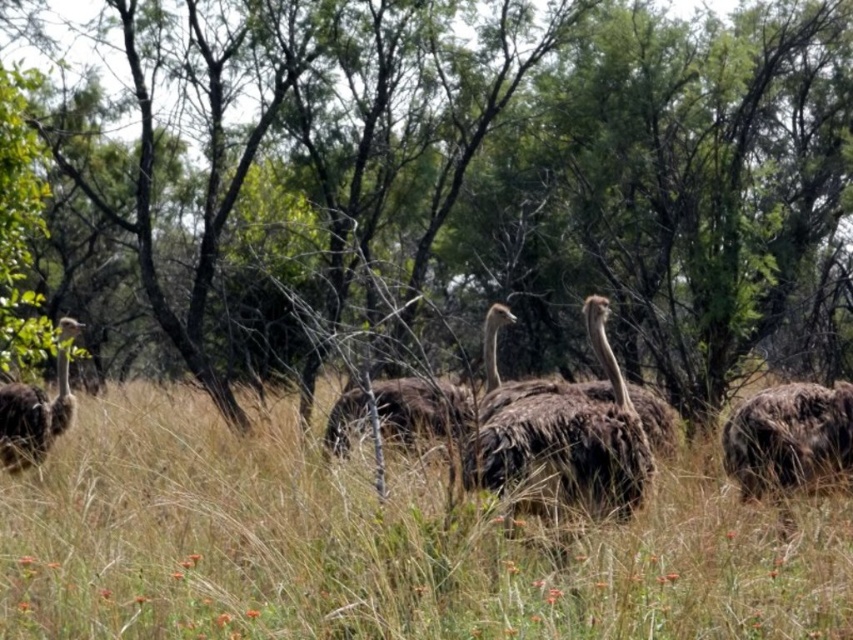
How distant is brown dry grass at center from brown fuzzy ostrich at center?

They are 6.55 feet apart.

The height and width of the screenshot is (640, 853). What do you see at coordinates (380, 545) in the screenshot? I see `brown dry grass at center` at bounding box center [380, 545].

Where is `brown dry grass at center`? Image resolution: width=853 pixels, height=640 pixels. brown dry grass at center is located at coordinates (380, 545).

Is point (154, 452) behind point (759, 483)?

Yes, point (154, 452) is farther from viewer.

The image size is (853, 640). Find the location of `brown dry grass at center`. brown dry grass at center is located at coordinates (380, 545).

Is point (68, 552) closer to viewer compared to point (724, 432)?

Yes.

This screenshot has height=640, width=853. In order to click on brown dry grass at center in this screenshot , I will do `click(380, 545)`.

Which of these two, brown dry grass at center or dark brown feathers at left, stands shorter?

Standing shorter between the two is brown dry grass at center.

Describe the element at coordinates (380, 545) in the screenshot. I see `brown dry grass at center` at that location.

Who is more forward, (459, 627) or (45, 428)?

Point (459, 627)

At what (x,y) coordinates should I click in order to perform the action: click on brown dry grass at center. Please return your answer as a coordinate pair (x, y). This screenshot has width=853, height=640. Looking at the image, I should click on (380, 545).